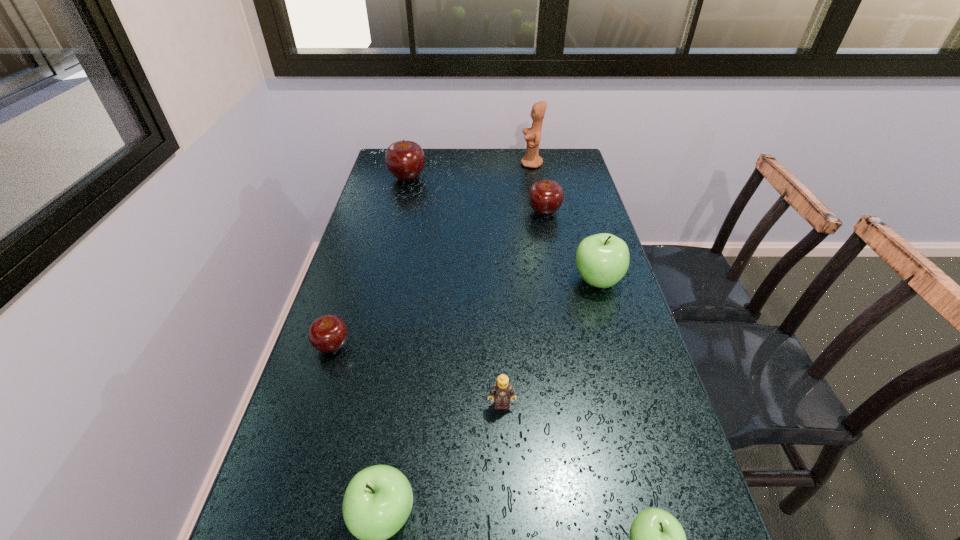
This screenshot has width=960, height=540. What are the coordinates of `free space in the image that satisfies the following two spatial constraints: 1. on the front-facing side of the figurine; 2. on the left side of the fifth nearest apple` in the screenshot? It's located at (540, 212).

Locate an element on the screen. free location that satisfies the following two spatial constraints: 1. on the back side of the third nearest apple; 2. on the left side of the rightmost red apple is located at coordinates (374, 212).